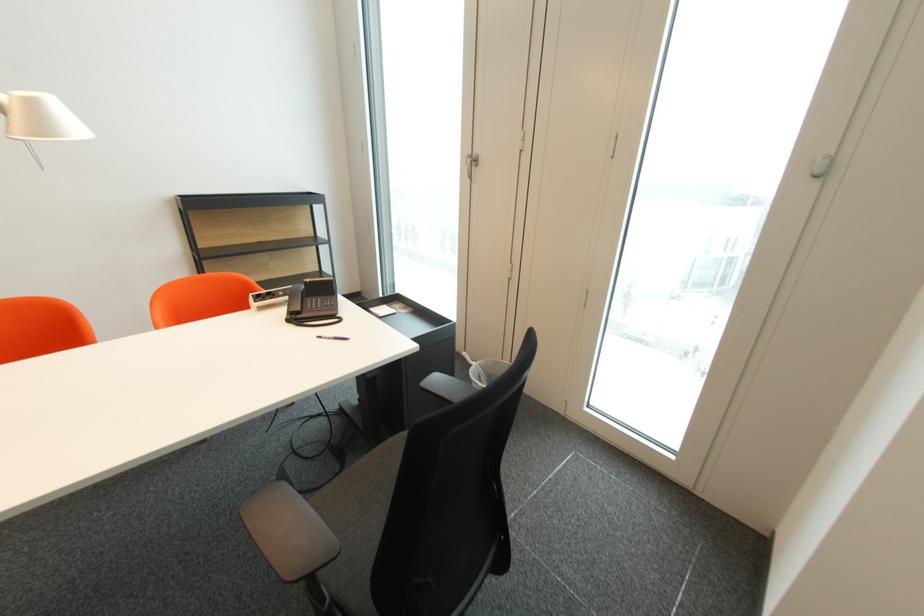
This screenshot has height=616, width=924. What do you see at coordinates (40, 118) in the screenshot?
I see `the white lamp head` at bounding box center [40, 118].